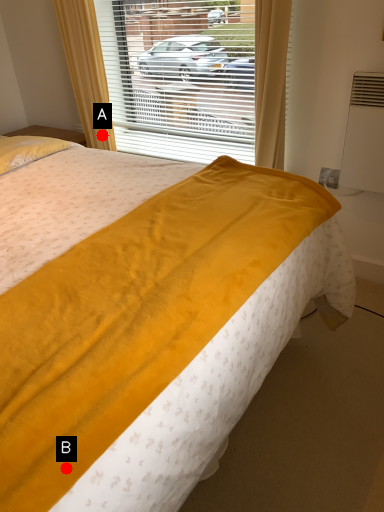
Question: Two points are circled on the image, labeled by A and B beside each circle. Which point is closer to the camera taking this photo?

Choices:
 (A) A is closer
 (B) B is closer

Answer: (B)